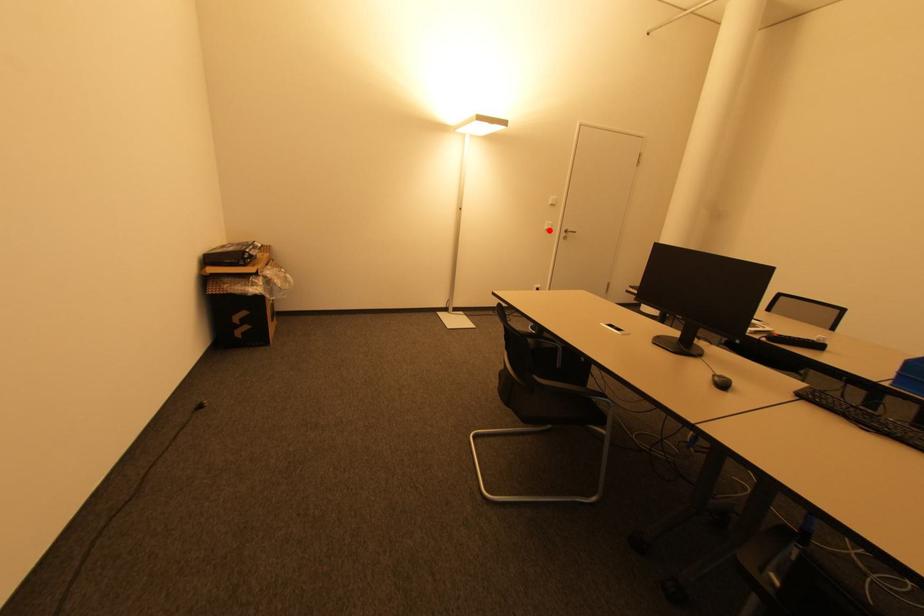
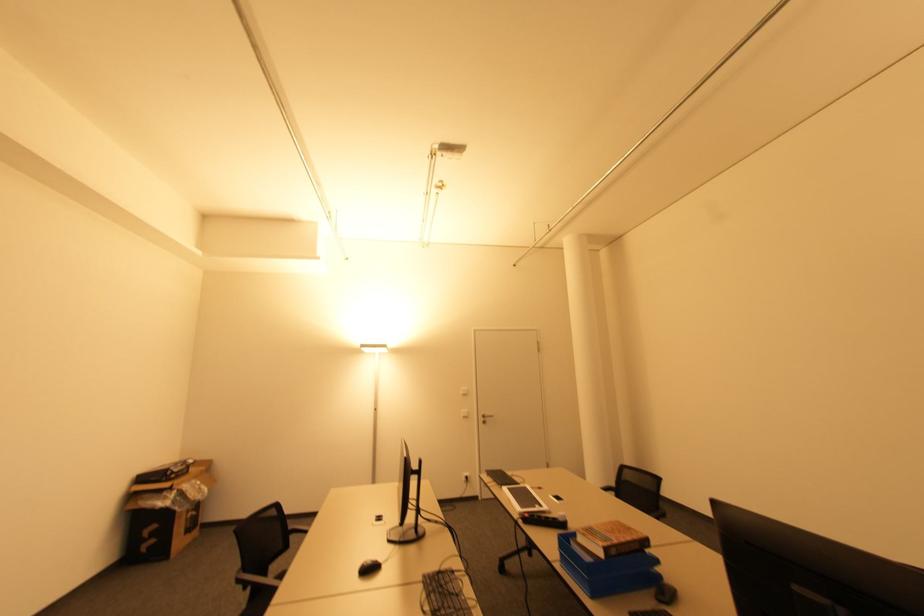
Find the pixel in the second image that matches the highlighted location in the first image.

(467, 416)